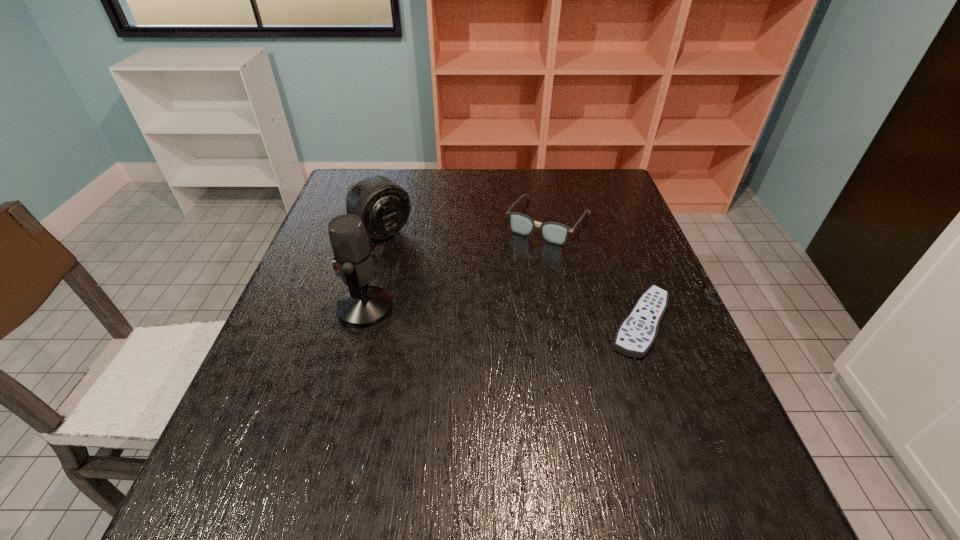
The height and width of the screenshot is (540, 960). Find the location of `free area in between the spectacles and the shortest object`. free area in between the spectacles and the shortest object is located at coordinates (594, 272).

Where is `vacant area that lies between the third tallest object and the tallest object`? Image resolution: width=960 pixels, height=540 pixels. vacant area that lies between the third tallest object and the tallest object is located at coordinates (457, 265).

At what (x,y) coordinates should I click in order to perform the action: click on free spot between the telephoto lens and the shortest object. Please return your answer as a coordinate pair (x, y). This screenshot has width=960, height=540. Looking at the image, I should click on (512, 276).

Where is `object that is the second closest to the tallest object`? Image resolution: width=960 pixels, height=540 pixels. object that is the second closest to the tallest object is located at coordinates (556, 233).

I want to click on the second closest object relative to the tallest object, so point(556,233).

The image size is (960, 540). In order to click on vacant space that satisfies the following two spatial constraints: 1. on the front side of the second tallest object; 2. on the left side of the remote control in this screenshot , I will do coord(356,323).

Find the location of `free spot that satisfies the following two spatial constraints: 1. on the front side of the microphone; 2. on the side of the second tallest object with the red ring`. free spot that satisfies the following two spatial constraints: 1. on the front side of the microphone; 2. on the side of the second tallest object with the red ring is located at coordinates (360, 308).

Locate an element on the screen. vacant area in the image that satisfies the following two spatial constraints: 1. on the back side of the telephoto lens; 2. on the left side of the second shortest object is located at coordinates click(x=384, y=222).